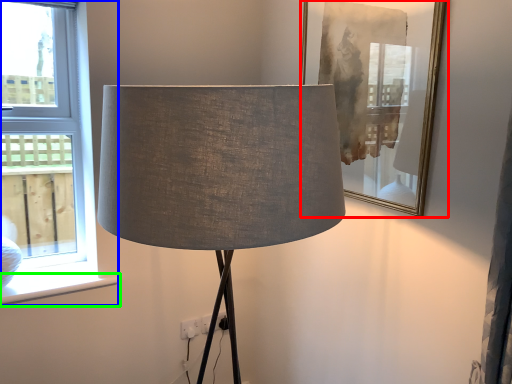
Question: Which object is positioned farthest from picture frame (highlighted by a red box)? Select from window (highlighted by a blue box) and window sill (highlighted by a green box).

Choices:
 (A) window
 (B) window sill

Answer: (B)